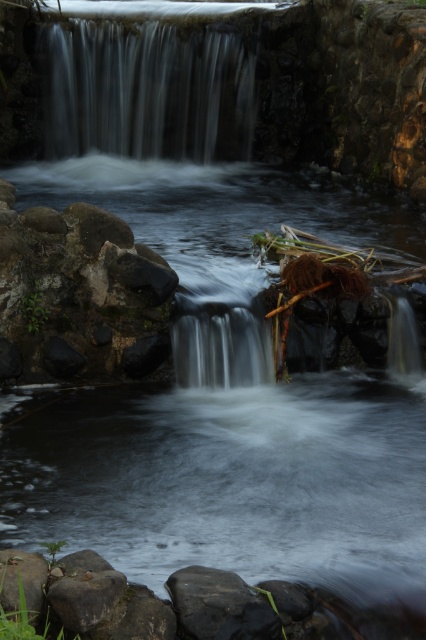
You are standing at the base of the waterfall and want to reach the smooth gray water at upper center. Which direction should you move to get closer to it, considering the smooth gray water at center is between you and the upper water?

To reach the smooth gray water at upper center, you should move forward towards it since it is closer to you than the smooth gray water at center, which is in between you and the upper water.

From the picture: You are a photographer planning to capture the waterfall and stream. You want to know if the smooth gray water at upper center is wider than the smooth gray water at center. Can you confirm this based on the scene?

The smooth gray water at upper center might be wider than smooth gray water at center according to the description provided.